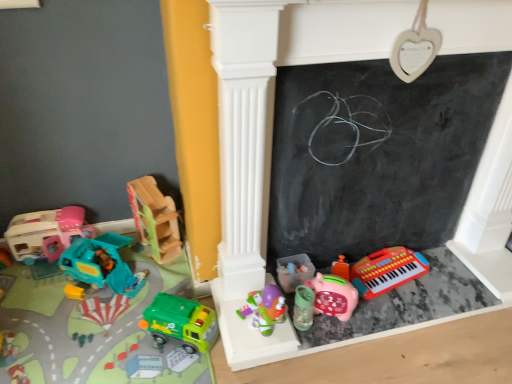
The height and width of the screenshot is (384, 512). I want to click on free space in front of wooden truck at left, acting as the 3th toy starting from the left, so 156,278.